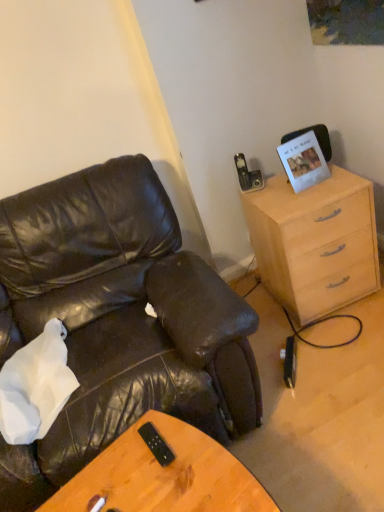
Where is `vacant space situated on the left part of black plastic remote at center`? The width and height of the screenshot is (384, 512). vacant space situated on the left part of black plastic remote at center is located at coordinates (110, 471).